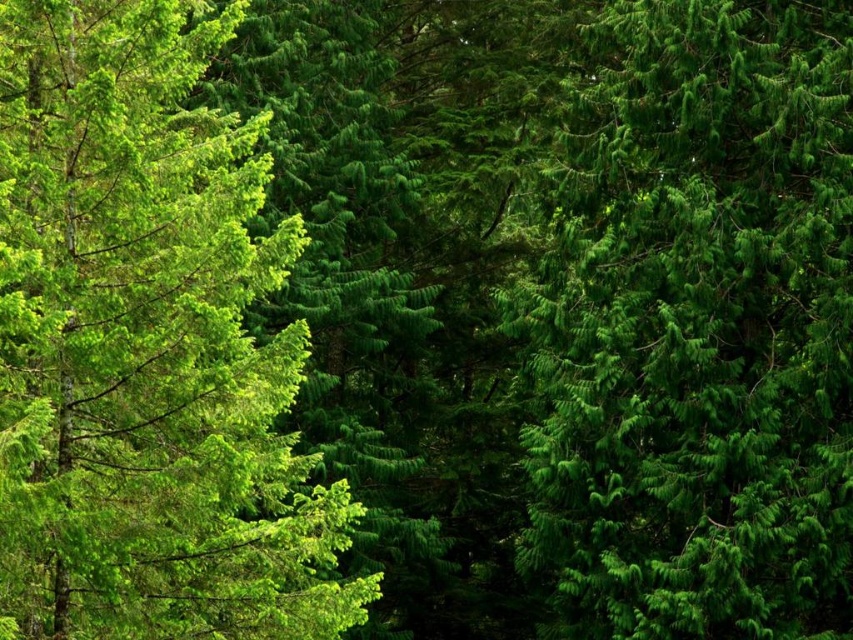
Based on the photo, who is more distant from viewer, (730, 572) or (22, 157)?

Point (730, 572)

Does green matte tree at center have a smaller size compared to green matte tree at left?

Yes.

Who is more distant from viewer, (589, 458) or (164, 490)?

The point (589, 458) is behind.

This screenshot has width=853, height=640. In order to click on green matte tree at center in this screenshot , I will do (698, 328).